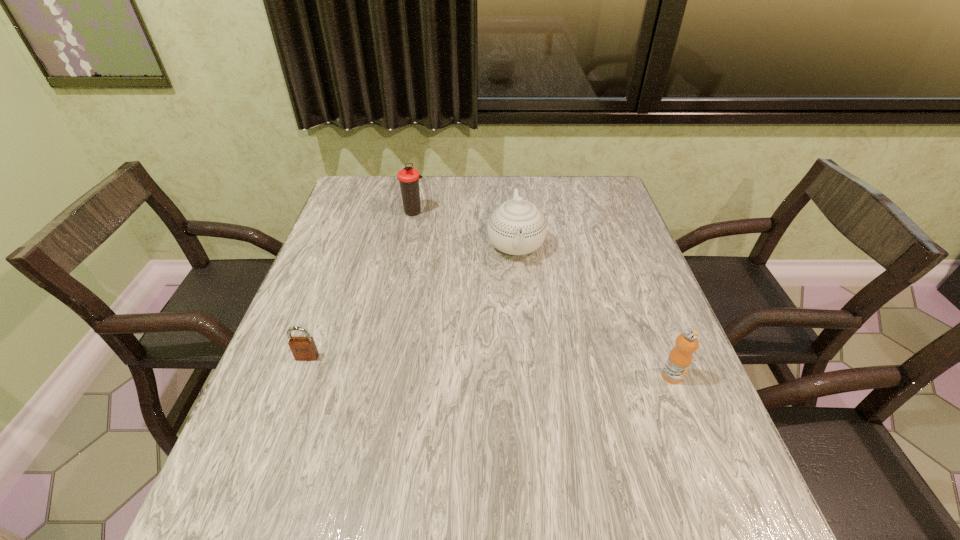
At what (x,y) coordinates should I click in order to perform the action: click on vacant space located 0.220m on the front label of the nearest object. Please return your answer as a coordinate pair (x, y). Looking at the image, I should click on (718, 495).

The height and width of the screenshot is (540, 960). In order to click on vacant area situated 0.090m on the front-facing side of the shortest object in this screenshot , I will do `click(293, 397)`.

Image resolution: width=960 pixels, height=540 pixels. I want to click on object located in the far edge section of the desktop, so click(408, 177).

The height and width of the screenshot is (540, 960). Find the location of `object located in the left edge section of the desktop`. object located in the left edge section of the desktop is located at coordinates (303, 348).

Find the location of a particular element. This screenshot has width=960, height=540. object present at the right edge is located at coordinates (679, 360).

Locate an element on the screen. The image size is (960, 540). free space at the far edge is located at coordinates (515, 179).

The width and height of the screenshot is (960, 540). In the image, there is a desktop. Find the location of `blank space at the left edge`. blank space at the left edge is located at coordinates (363, 301).

This screenshot has width=960, height=540. In the image, there is a desktop. What are the coordinates of `vacant area at the right edge` in the screenshot? It's located at (592, 252).

The width and height of the screenshot is (960, 540). Identify the location of vacant space at the far left corner of the desktop. (349, 188).

This screenshot has width=960, height=540. In the image, there is a desktop. In order to click on free region at the far right corner in this screenshot , I will do `click(567, 177)`.